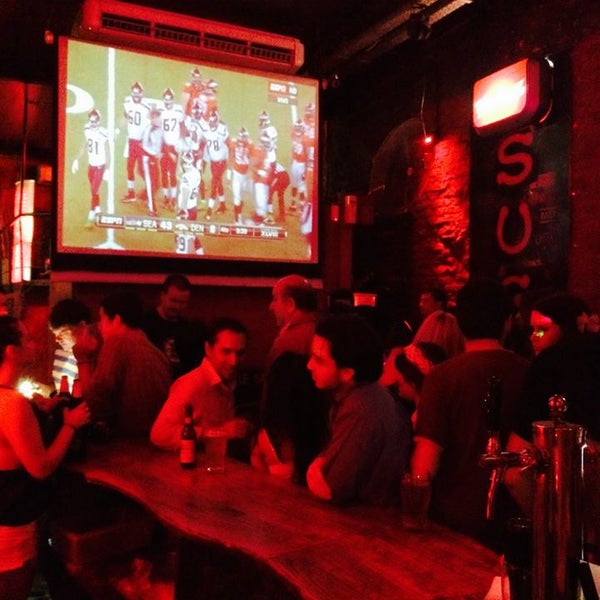
Identify the location of bar. (292, 535).